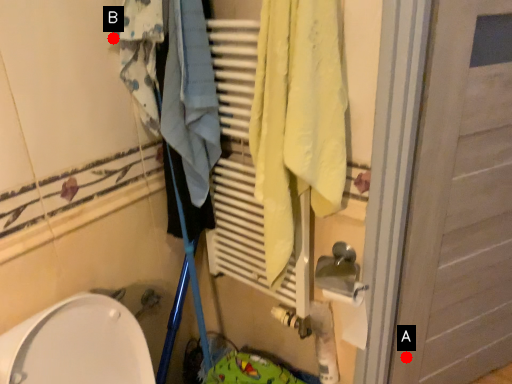
Question: Two points are circled on the image, labeled by A and B beside each circle. Which of the following is the closest to the observer?

Choices:
 (A) A is closer
 (B) B is closer

Answer: (B)